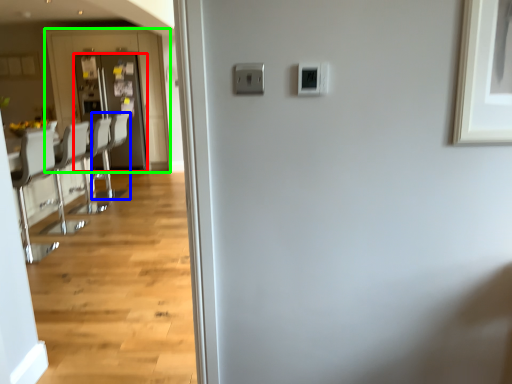
Question: Which is farther away from door (highlighted by a red box)? armchair (highlighted by a blue box) or screen door (highlighted by a green box)?

Choices:
 (A) armchair
 (B) screen door

Answer: (A)